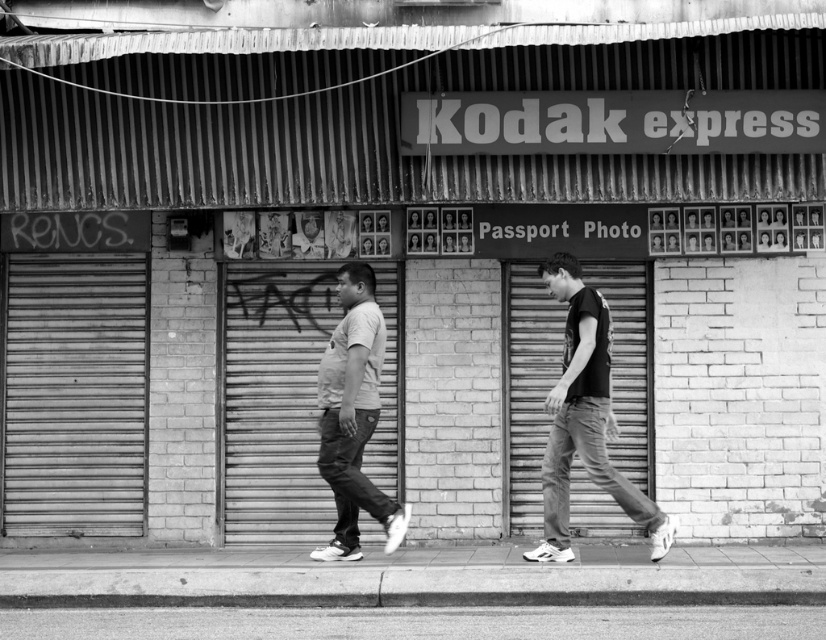
You are standing in front of the Kodak express storefront and want to take a photo of both the point at coordinates point (355, 268) and point (63, 604). Since you can only focus on one point at a time, which point should you focus on first to ensure the other point is still in focus?

You should focus on point (355, 268) first because it is closer to the camera than point (63, 604). By focusing on the closer point, the farther point will still be within the depth of field, ensuring both are in focus.